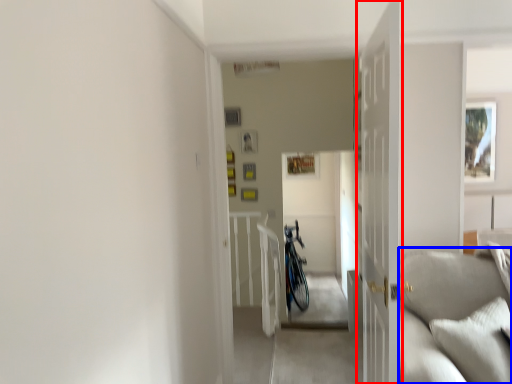
Question: Which object appears farthest to the camera in this image, door (highlighted by a red box) or couch (highlighted by a blue box)?

Choices:
 (A) door
 (B) couch

Answer: (B)